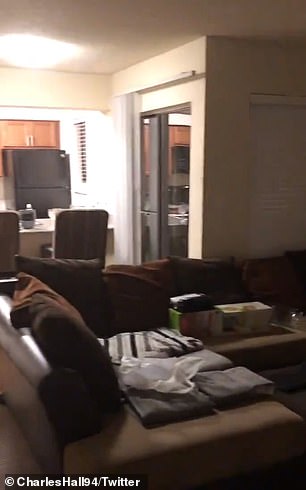
Identify the location of white blinds on window. (82, 136).